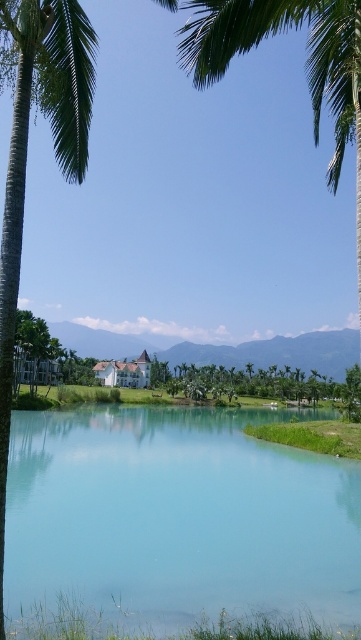
Which of these two, clear blue water at center or green leafy tree at center, stands taller?

green leafy tree at center is taller.

Does point (10, 566) lie in front of point (237, 381)?

That is True.

Find the location of a particular element. The image size is (361, 640). clear blue water at center is located at coordinates (176, 516).

Between clear blue water at center and green leafy palm tree at left, which one appears on the right side from the viewer's perspective?

From the viewer's perspective, green leafy palm tree at left appears more on the right side.

Does point (132, 580) come closer to viewer compared to point (53, 58)?

No, it is not.

You are a GUI agent. You are given a task and a screenshot of the screen. Output one action in this format:
    pyautogui.click(x=<x>, y=<y>)
    Task: Click on the clear blue water at center
    
    Given the screenshot: What is the action you would take?
    pyautogui.click(x=176, y=516)

Where is `green leafy palm tree at left`? This screenshot has width=361, height=640. green leafy palm tree at left is located at coordinates (27, 150).

Who is higher up, green leafy palm tree at left or green leafy tree at center?

green leafy palm tree at left is higher up.

Is point (10, 205) positioned in front of point (281, 392)?

Yes, it is in front of point (281, 392).

Identify the location of green leafy palm tree at left. This screenshot has height=640, width=361. (27, 150).